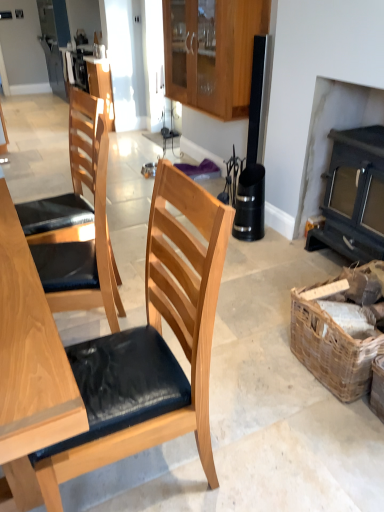
Where is `vacant region to the left of woven brown picnic basket at lower right`? vacant region to the left of woven brown picnic basket at lower right is located at coordinates (258, 359).